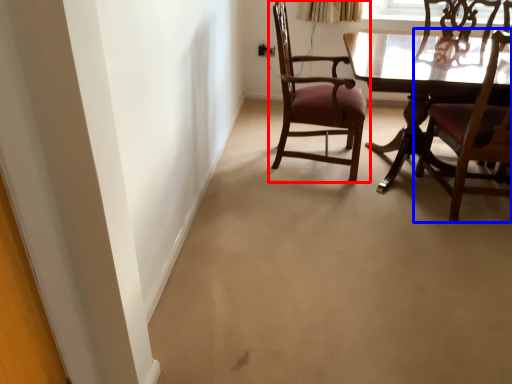
Question: Which of the following is the farthest to the observer, chair (highlighted by a red box) or chair (highlighted by a blue box)?

Choices:
 (A) chair
 (B) chair

Answer: (A)